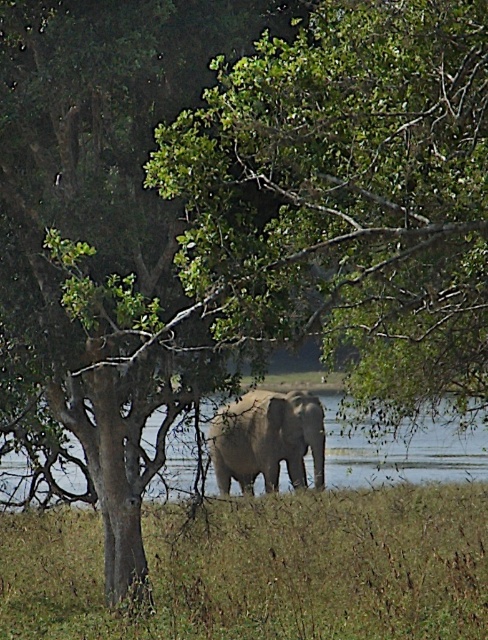
Question: Can you confirm if green grassy at lower center is thinner than clear water at elephant center?

Choices:
 (A) no
 (B) yes

Answer: (B)

Question: Considering the real-world distances, which object is farthest from the clear water at elephant center?

Choices:
 (A) green grassy at lower center
 (B) gray textured elephant at center

Answer: (A)

Question: Among these objects, which one is nearest to the camera?

Choices:
 (A) gray textured elephant at center
 (B) green grassy at lower center

Answer: (B)

Question: Considering the relative positions of clear water at elephant center and gray textured elephant at center in the image provided, where is clear water at elephant center located with respect to gray textured elephant at center?

Choices:
 (A) below
 (B) above

Answer: (A)

Question: Can you confirm if clear water at elephant center is positioned to the right of gray textured elephant at center?

Choices:
 (A) no
 (B) yes

Answer: (A)

Question: Based on their relative distances, which object is farther from the clear water at elephant center?

Choices:
 (A) gray textured elephant at center
 (B) green grassy at lower center

Answer: (B)